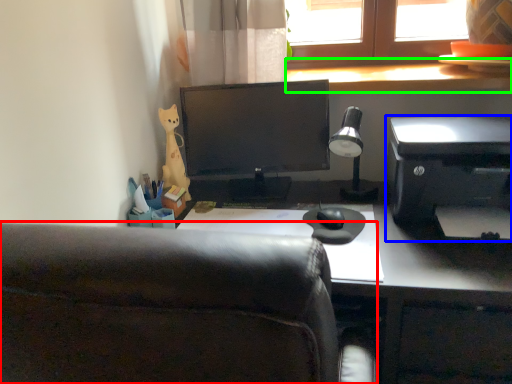
Question: Considering the real-world distances, which object is farthest from chair (highlighted by a red box)? printer (highlighted by a blue box) or window sill (highlighted by a green box)?

Choices:
 (A) printer
 (B) window sill

Answer: (B)